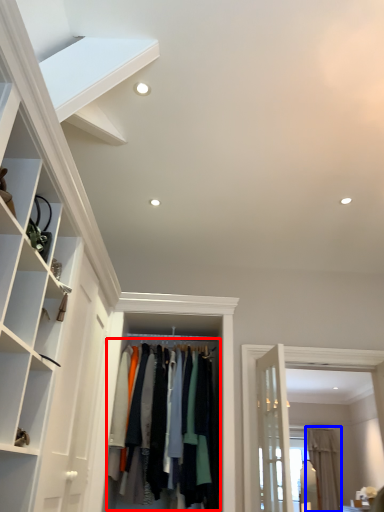
Question: Which point is closer to the camera, clothing (highlighted by a red box) or curtain (highlighted by a blue box)?

Choices:
 (A) clothing
 (B) curtain

Answer: (A)